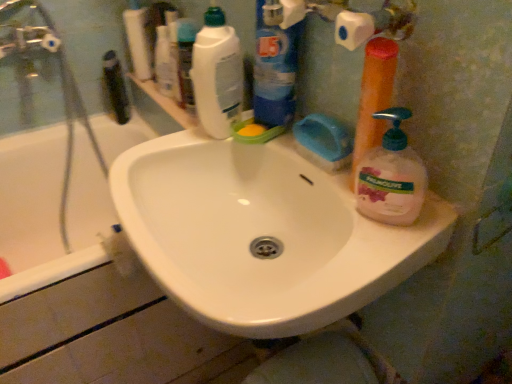
The width and height of the screenshot is (512, 384). What do you see at coordinates (274, 66) in the screenshot? I see `blue plastic bottle at upper center, the 2th cleaning product when ordered from left to right` at bounding box center [274, 66].

I want to click on pink translucent liquid soap at right, which ranks as the 1th cleaning product in right-to-left order, so click(x=391, y=176).

The image size is (512, 384). I want to click on white glossy bathtub at left, so click(50, 209).

Consider the image. Considering the relative positions of white glossy bottle at upper center, which is the 1th cleaning product from left to right, and white glossy sink at center in the image provided, is white glossy bottle at upper center, which is the 1th cleaning product from left to right, to the left or to the right of white glossy sink at center?

Based on their positions, white glossy bottle at upper center, which is the 1th cleaning product from left to right, is located to the left of white glossy sink at center.

Which is in front, point (207, 74) or point (401, 257)?

Point (401, 257)

Is white glossy bottle at upper center, which is the 1th cleaning product from left to right, positioned with its back to white glossy sink at center?

No.

Is white glossy bottle at upper center, positioned as the 4th cleaning product in right-to-left order, taller or shorter than white glossy sink at center?

white glossy bottle at upper center, positioned as the 4th cleaning product in right-to-left order, is taller than white glossy sink at center.

Based on the photo, from a real-world perspective, between white glossy bottle at upper center, the second toiletry from the left, and white glossy bottle at upper center, positioned as the 4th cleaning product in right-to-left order, who is vertically higher?

white glossy bottle at upper center, positioned as the 4th cleaning product in right-to-left order.

From the image's perspective, does white glossy bottle at upper center, acting as the 1th toiletry starting from the front, appear higher than white glossy bottle at upper center, which is the 1th cleaning product from left to right?

Yes, from the image's perspective, white glossy bottle at upper center, acting as the 1th toiletry starting from the front, is above white glossy bottle at upper center, which is the 1th cleaning product from left to right.

Is white glossy bottle at upper center, the second toiletry from the left, far from white glossy bottle at upper center, which is the 1th cleaning product from left to right?

No, white glossy bottle at upper center, the second toiletry from the left, is in close proximity to white glossy bottle at upper center, which is the 1th cleaning product from left to right.

Can you confirm if white glossy bottle at upper center, positioned as the second toiletry in back-to-front order, is shorter than white glossy bottle at upper center, positioned as the 4th cleaning product in right-to-left order?

Indeed, white glossy bottle at upper center, positioned as the second toiletry in back-to-front order, has a lesser height compared to white glossy bottle at upper center, positioned as the 4th cleaning product in right-to-left order.

From the image's perspective, is pink translucent liquid soap at right, which ranks as the 1th cleaning product in right-to-left order, located beneath white glossy sink at center?

No, from the image's perspective, pink translucent liquid soap at right, which ranks as the 1th cleaning product in right-to-left order, is not below white glossy sink at center.

Is white glossy sink at center surrounded by pink translucent liquid soap at right, which ranks as the 1th cleaning product in right-to-left order?

No, white glossy sink at center is not inside pink translucent liquid soap at right, which ranks as the 1th cleaning product in right-to-left order.

In the scene shown: From a real-world perspective, who is located higher, pink translucent liquid soap at right, arranged as the fourth cleaning product when viewed from the left, or white glossy sink at center?

pink translucent liquid soap at right, arranged as the fourth cleaning product when viewed from the left, is physically above.

Looking at their sizes, would you say pink translucent liquid soap at right, arranged as the fourth cleaning product when viewed from the left, is wider or thinner than white glossy sink at center?

Considering their sizes, pink translucent liquid soap at right, arranged as the fourth cleaning product when viewed from the left, looks slimmer than white glossy sink at center.

Measure the distance from black plastic toothbrush at left, which ranks as the 2th toiletry in front-to-back order, to orange plastic pump bottle at right, which is the second cleaning product in right-to-left order.

black plastic toothbrush at left, which ranks as the 2th toiletry in front-to-back order, and orange plastic pump bottle at right, which is the second cleaning product in right-to-left order, are 1.01 meters apart from each other.

Could you tell me if black plastic toothbrush at left, the 1th toiletry from the left, is turned towards orange plastic pump bottle at right, the third cleaning product viewed from the left?

No, black plastic toothbrush at left, the 1th toiletry from the left, is not turned towards orange plastic pump bottle at right, the third cleaning product viewed from the left.

Is black plastic toothbrush at left, the 1th toiletry when ordered from back to front, bigger or smaller than orange plastic pump bottle at right, which is the second cleaning product in right-to-left order?

In the image, black plastic toothbrush at left, the 1th toiletry when ordered from back to front, appears to be larger than orange plastic pump bottle at right, which is the second cleaning product in right-to-left order.

Looking at their sizes, would you say black plastic toothbrush at left, which ranks as the 2th toiletry in front-to-back order, is wider or thinner than orange plastic pump bottle at right, which is the second cleaning product in right-to-left order?

black plastic toothbrush at left, which ranks as the 2th toiletry in front-to-back order, is wider than orange plastic pump bottle at right, which is the second cleaning product in right-to-left order.

Does white glossy bottle at upper center, positioned as the second toiletry in back-to-front order, have a larger size compared to white glossy sink at center?

No.

Between white glossy bottle at upper center, the second toiletry from the left, and white glossy sink at center, which one is positioned in front?

white glossy sink at center is more forward.

Considering the relative sizes of white glossy bottle at upper center, the 1th toiletry when ordered from right to left, and white glossy sink at center in the image provided, is white glossy bottle at upper center, the 1th toiletry when ordered from right to left, wider than white glossy sink at center?

In fact, white glossy bottle at upper center, the 1th toiletry when ordered from right to left, might be narrower than white glossy sink at center.

From the image's perspective, which is below, white glossy bottle at upper center, acting as the 1th toiletry starting from the front, or white glossy sink at center?

From the image's view, white glossy sink at center is below.

Considering the sizes of black plastic toothbrush at left, which ranks as the 2th toiletry in front-to-back order, and white glossy sink at center in the image, is black plastic toothbrush at left, which ranks as the 2th toiletry in front-to-back order, bigger or smaller than white glossy sink at center?

Clearly, black plastic toothbrush at left, which ranks as the 2th toiletry in front-to-back order, is smaller in size than white glossy sink at center.

Is black plastic toothbrush at left, which ranks as the 2th toiletry in front-to-back order, looking in the opposite direction of white glossy sink at center?

black plastic toothbrush at left, which ranks as the 2th toiletry in front-to-back order, is not turned away from white glossy sink at center.

Considering the relative positions of black plastic toothbrush at left, the 1th toiletry when ordered from back to front, and white glossy sink at center in the image provided, is black plastic toothbrush at left, the 1th toiletry when ordered from back to front, to the left of white glossy sink at center from the viewer's perspective?

Indeed, black plastic toothbrush at left, the 1th toiletry when ordered from back to front, is positioned on the left side of white glossy sink at center.

Is white glossy sink at center located within black plastic toothbrush at left, which ranks as the 2th toiletry in front-to-back order?

No, white glossy sink at center is not surrounded by black plastic toothbrush at left, which ranks as the 2th toiletry in front-to-back order.

Are blue plastic bottle at upper center, the 2th cleaning product when ordered from left to right, and white glossy sink at center beside each other?

No, blue plastic bottle at upper center, the 2th cleaning product when ordered from left to right, is not next to white glossy sink at center.

From a real-world perspective, which object stands above the other?

In real-world perspective, blue plastic bottle at upper center, the third cleaning product in the right-to-left sequence, is above.

From the image's perspective, which is below, blue plastic bottle at upper center, the 2th cleaning product when ordered from left to right, or white glossy sink at center?

white glossy sink at center is shown below in the image.

In the image, is blue plastic bottle at upper center, the third cleaning product in the right-to-left sequence, on the left side or the right side of white glossy sink at center?

Clearly, blue plastic bottle at upper center, the third cleaning product in the right-to-left sequence, is on the right of white glossy sink at center in the image.

The width and height of the screenshot is (512, 384). What are the coordinates of `sink directly beneath the white glossy bottle at upper center, which is the 1th cleaning product from left to right (from a real-world perspective)` in the screenshot? It's located at (262, 234).

At what (x,y) coordinates should I click in order to perform the action: click on the 1st toiletry behind the white glossy bottle at upper center, which is the 1th cleaning product from left to right, counting from the anchor's position. Please return your answer as a coordinate pair (x, y). Image resolution: width=512 pixels, height=384 pixels. Looking at the image, I should click on (185, 61).

Looking at the image, which one is located closer to black plastic toothbrush at left, which ranks as the 2th toiletry in front-to-back order, white glossy bottle at upper center, the 1th toiletry when ordered from right to left, or white glossy sink at center?

white glossy bottle at upper center, the 1th toiletry when ordered from right to left.

Looking at the image, which one is located closer to white glossy bathtub at left, pink translucent liquid soap at right, which ranks as the 1th cleaning product in right-to-left order, or white glossy bottle at upper center, the second toiletry from the left?

white glossy bottle at upper center, the second toiletry from the left, lies closer to white glossy bathtub at left than the other object.

Which object lies nearer to the anchor point white glossy sink at center, white glossy bottle at upper center, the second toiletry from the left, or black plastic toothbrush at left, placed as the 2th toiletry when sorted from right to left?

The object closer to white glossy sink at center is white glossy bottle at upper center, the second toiletry from the left.

Looking at the image, which one is located closer to pink translucent liquid soap at right, which ranks as the 1th cleaning product in right-to-left order, white glossy bottle at upper center, positioned as the 4th cleaning product in right-to-left order, or white glossy bathtub at left?

white glossy bottle at upper center, positioned as the 4th cleaning product in right-to-left order.

Based on their spatial positions, is white glossy sink at center or pink translucent liquid soap at right, which ranks as the 1th cleaning product in right-to-left order, further from white glossy bottle at upper center, positioned as the second toiletry in back-to-front order?

pink translucent liquid soap at right, which ranks as the 1th cleaning product in right-to-left order, lies further to white glossy bottle at upper center, positioned as the second toiletry in back-to-front order, than the other object.

Consider the image. From the image, which object appears to be nearer to white glossy bottle at upper center, the second toiletry from the left, white glossy bottle at upper center, positioned as the 4th cleaning product in right-to-left order, or orange plastic pump bottle at right, the third cleaning product viewed from the left?

white glossy bottle at upper center, positioned as the 4th cleaning product in right-to-left order, lies closer to white glossy bottle at upper center, the second toiletry from the left, than the other object.

Considering their positions, is black plastic toothbrush at left, the 1th toiletry from the left, positioned closer to white glossy sink at center than white glossy bottle at upper center, positioned as the second toiletry in back-to-front order?

white glossy bottle at upper center, positioned as the second toiletry in back-to-front order, is closer to white glossy sink at center.

Consider the image. When comparing their distances from black plastic toothbrush at left, the 1th toiletry when ordered from back to front, does orange plastic pump bottle at right, which is the second cleaning product in right-to-left order, or white glossy bottle at upper center, which is the 1th cleaning product from left to right, seem closer?

Based on the image, white glossy bottle at upper center, which is the 1th cleaning product from left to right, appears to be nearer to black plastic toothbrush at left, the 1th toiletry when ordered from back to front.

This screenshot has height=384, width=512. I want to click on toiletry positioned between blue plastic bottle at upper center, the 2th cleaning product when ordered from left to right, and black plastic toothbrush at left, the 1th toiletry from the left, from near to far, so click(185, 61).

You are a GUI agent. You are given a task and a screenshot of the screen. Output one action in this format:
    pyautogui.click(x=<x>, y=<y>)
    Task: Click on the sink between white glossy bathtub at left and blue plastic bottle at upper center, the third cleaning product in the right-to-left sequence, in the horizontal direction
    The width and height of the screenshot is (512, 384).
    Given the screenshot: What is the action you would take?
    pyautogui.click(x=262, y=234)

Find the location of a particular element. The height and width of the screenshot is (384, 512). cleaning product located between white glossy bathtub at left and blue plastic bottle at upper center, the 2th cleaning product when ordered from left to right, in the left-right direction is located at coordinates (217, 75).

Identify the location of sink located between white glossy bathtub at left and pink translucent liquid soap at right, arranged as the fourth cleaning product when viewed from the left, in the left-right direction. (262, 234).